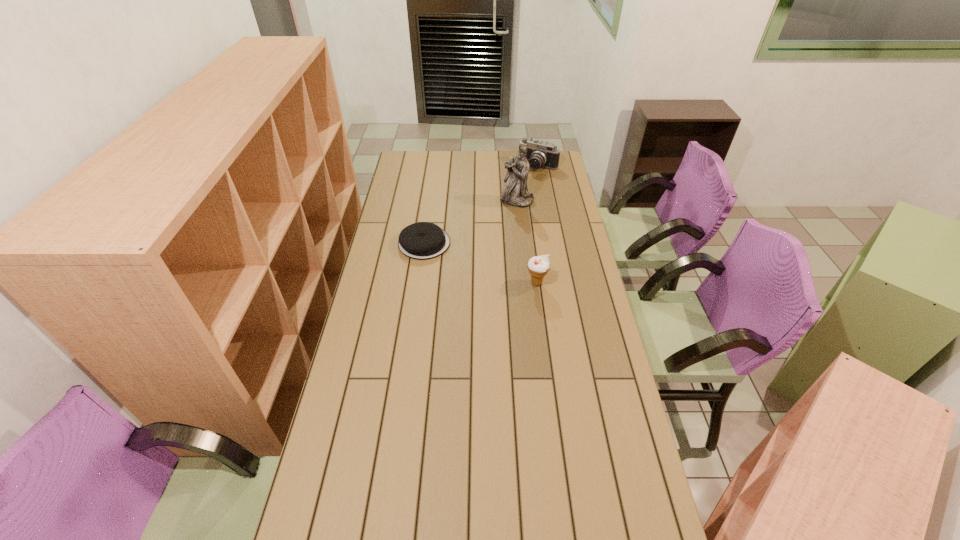
Identify the location of free spot at the left edge of the desktop. (394, 199).

Identify the location of free spot at the right edge of the desktop. This screenshot has height=540, width=960. (557, 269).

Identify the location of vacant space at the far left corner of the desktop. (420, 152).

You are a GUI agent. You are given a task and a screenshot of the screen. Output one action in this format:
    pyautogui.click(x=<x>, y=<y>)
    Task: Click on the vacant space at the far right corner of the desktop
    The height and width of the screenshot is (540, 960).
    Given the screenshot: What is the action you would take?
    pyautogui.click(x=557, y=170)

The height and width of the screenshot is (540, 960). What are the coordinates of `vacant space that's between the nearest object and the camera` in the screenshot? It's located at (538, 225).

Find the location of `empty location between the camera and the pancake`. empty location between the camera and the pancake is located at coordinates (481, 205).

Identify the location of blank region between the third farthest object and the farthest object. The height and width of the screenshot is (540, 960). (481, 205).

Find the location of a particular element. This screenshot has width=960, height=540. empty space between the third nearest object and the farthest object is located at coordinates (528, 184).

Locate an element on the screen. unoccupied area between the nearest object and the figurine is located at coordinates coord(527,242).

Locate an element on the screen. The image size is (960, 540). free spot between the nearest object and the camera is located at coordinates (538, 225).